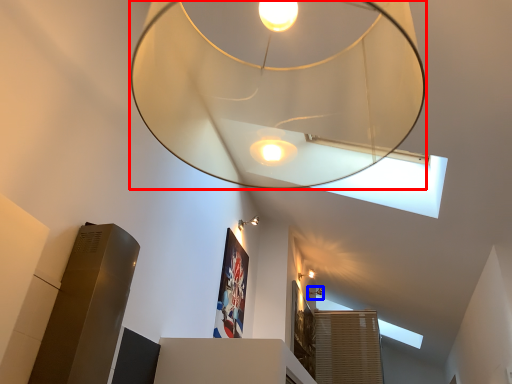
Question: Which of the following is the closest to the observer, lamp (highlighted by a red box) or lamp (highlighted by a blue box)?

Choices:
 (A) lamp
 (B) lamp

Answer: (A)